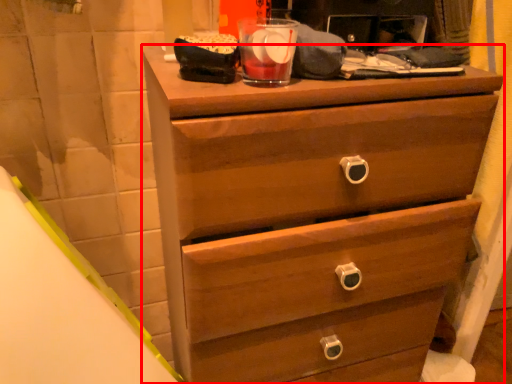
Question: From the image's perspective, where is chest of drawers (annotated by the red box) located relative to beverage?

Choices:
 (A) above
 (B) below

Answer: (B)